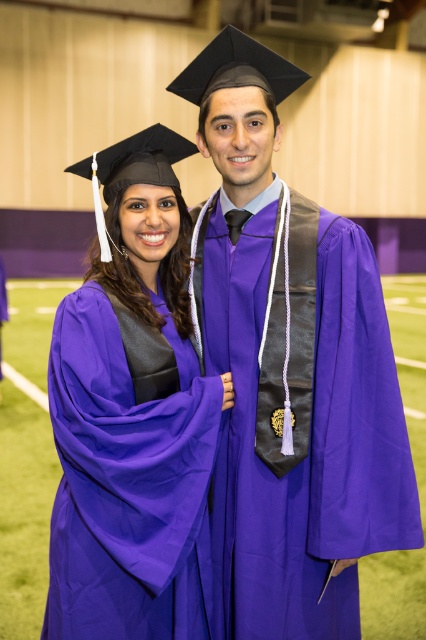
Question: Among these points, which one is farthest from the camera?

Choices:
 (A) (143, 419)
 (B) (233, 580)

Answer: (B)

Question: Does purple matte graduation gown at center appear over purple matte graduation gown at left?

Choices:
 (A) yes
 (B) no

Answer: (A)

Question: Is purple matte graduation gown at center smaller than purple matte graduation gown at left?

Choices:
 (A) no
 (B) yes

Answer: (A)

Question: Does purple matte graduation gown at center come behind purple matte graduation gown at left?

Choices:
 (A) yes
 (B) no

Answer: (A)

Question: Which point is farther to the camera?

Choices:
 (A) (359, 552)
 (B) (146, 577)

Answer: (A)